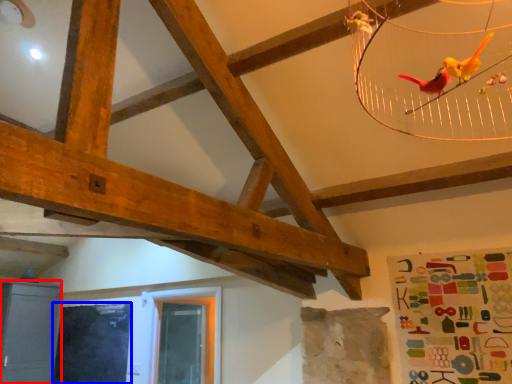
Question: Which point is further to the camera, furniture (highlighted by a red box) or window screen (highlighted by a blue box)?

Choices:
 (A) furniture
 (B) window screen

Answer: (A)